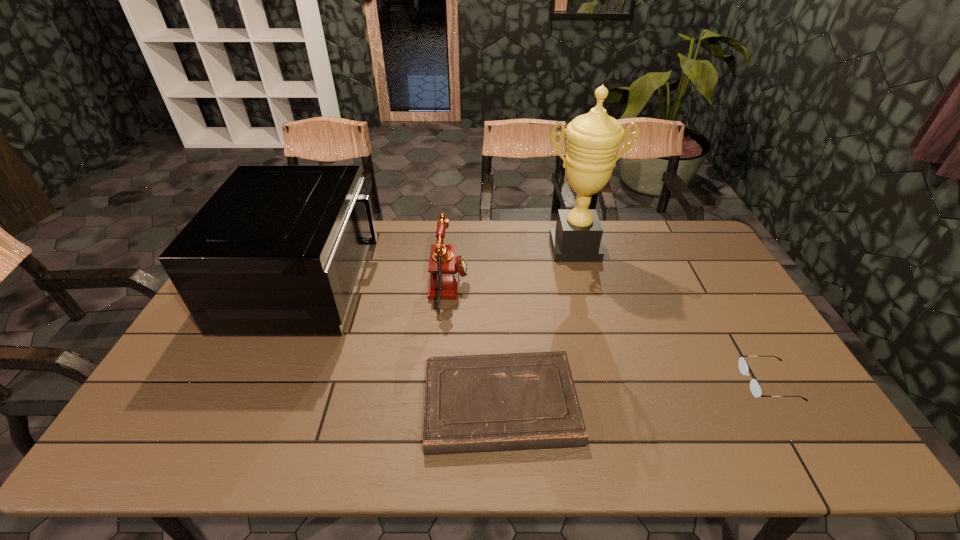
Find the location of a particular element. blank space at the near edge is located at coordinates (726, 426).

This screenshot has width=960, height=540. In order to click on free space at the left edge of the desktop in this screenshot , I will do `click(213, 336)`.

Locate an element on the screen. This screenshot has height=540, width=960. free space at the right edge of the desktop is located at coordinates (704, 324).

Where is `free space between the rightmost object and the leftmost object`? free space between the rightmost object and the leftmost object is located at coordinates (538, 333).

This screenshot has width=960, height=540. What are the coordinates of `vacant area between the third shortest object and the paperback book` in the screenshot? It's located at (475, 346).

What are the coordinates of `unoccupied area between the tallest object and the spectacles` in the screenshot? It's located at (672, 315).

This screenshot has width=960, height=540. Identify the location of free space between the trophy cup and the telephone. (512, 268).

Identify the location of empty space that is in between the tallest object and the telephone. (512, 268).

Locate an element on the screen. This screenshot has height=540, width=960. empty space between the microwave_oven and the paperback book is located at coordinates (404, 343).

At what (x,y) coordinates should I click in order to perform the action: click on vacant area that lies between the paperback book and the tallest object. Please return your answer as a coordinate pair (x, y). Image resolution: width=960 pixels, height=540 pixels. Looking at the image, I should click on (538, 326).